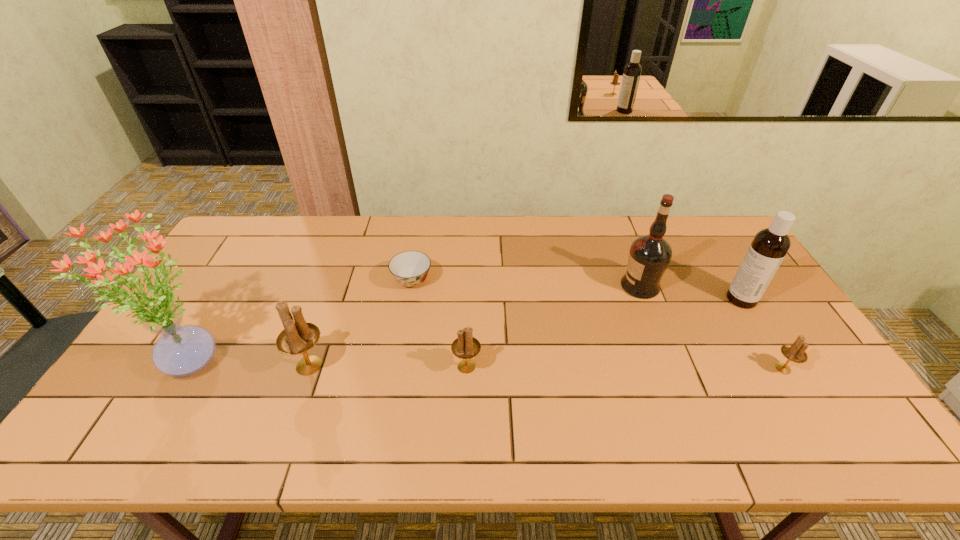
You are a GUI agent. You are given a task and a screenshot of the screen. Output one action in this format:
    pyautogui.click(x=<x>, y=<y>)
    Task: Click on the flower arrangement
    This screenshot has width=960, height=540.
    Given the screenshot: What is the action you would take?
    pyautogui.click(x=182, y=350)

Locate an element on the screen. The height and width of the screenshot is (540, 960). dishwasher detergent is located at coordinates (766, 252).

This screenshot has height=540, width=960. I want to click on free point located 0.350m on the right of the leftmost candle holder, so click(x=464, y=366).

Where is `vacant space located on the right of the fourth object from right to left`? The width and height of the screenshot is (960, 540). vacant space located on the right of the fourth object from right to left is located at coordinates (562, 367).

The image size is (960, 540). Find the location of `free space located on the left of the rightmost candle holder`. free space located on the left of the rightmost candle holder is located at coordinates (699, 369).

The height and width of the screenshot is (540, 960). In order to click on blank space located on the surface of the liquor in this screenshot , I will do `click(595, 286)`.

You are a GUI agent. You are given a task and a screenshot of the screen. Output one action in this format:
    pyautogui.click(x=<x>, y=<y>)
    Task: Click on the free space located on the surface of the liquor
    Image resolution: width=960 pixels, height=540 pixels.
    Given the screenshot: What is the action you would take?
    pyautogui.click(x=550, y=286)

Locate an element on the screen. The image size is (960, 540). vacant space located 0.370m on the surface of the liquor is located at coordinates (502, 286).

The image size is (960, 540). I want to click on vacant space situated on the front of the soup bowl, so coord(395,384).

This screenshot has width=960, height=540. I want to click on vacant region located 0.090m on the back of the leftmost object, so click(x=223, y=304).